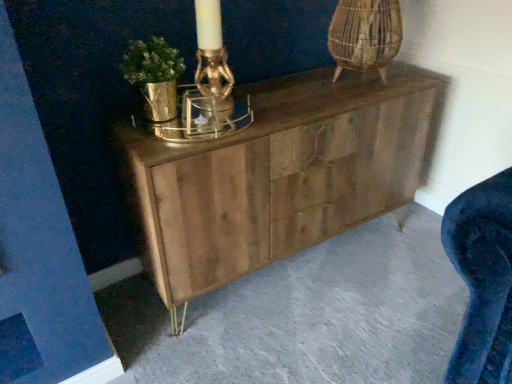
Question: Is natural wood cabinet at center taller than wooden chest of drawers at center?

Choices:
 (A) no
 (B) yes

Answer: (A)

Question: Is there a large distance between natural wood cabinet at center and wooden chest of drawers at center?

Choices:
 (A) yes
 (B) no

Answer: (B)

Question: Is natural wood cabinet at center completely or partially outside of wooden chest of drawers at center?

Choices:
 (A) yes
 (B) no

Answer: (A)

Question: From the image's perspective, is natural wood cabinet at center located above wooden chest of drawers at center?

Choices:
 (A) yes
 (B) no

Answer: (B)

Question: Does natural wood cabinet at center appear on the right side of wooden chest of drawers at center?

Choices:
 (A) yes
 (B) no

Answer: (A)

Question: Is the position of natural wood cabinet at center less distant than that of wooden chest of drawers at center?

Choices:
 (A) no
 (B) yes

Answer: (B)

Question: Does wooden chest of drawers at center have a smaller size compared to natural wood cabinet at center?

Choices:
 (A) no
 (B) yes

Answer: (A)

Question: Is wooden chest of drawers at center surrounding natural wood cabinet at center?

Choices:
 (A) yes
 (B) no

Answer: (B)

Question: Does wooden chest of drawers at center have a lesser height compared to natural wood cabinet at center?

Choices:
 (A) yes
 (B) no

Answer: (B)

Question: Is wooden chest of drawers at center outside of natural wood cabinet at center?

Choices:
 (A) yes
 (B) no

Answer: (A)

Question: Is wooden chest of drawers at center at the right side of natural wood cabinet at center?

Choices:
 (A) yes
 (B) no

Answer: (B)

Question: From the image's perspective, does wooden chest of drawers at center appear higher than natural wood cabinet at center?

Choices:
 (A) no
 (B) yes

Answer: (B)

Question: From the image's perspective, is wooden chest of drawers at center located above or below natural wood cabinet at center?

Choices:
 (A) below
 (B) above

Answer: (B)